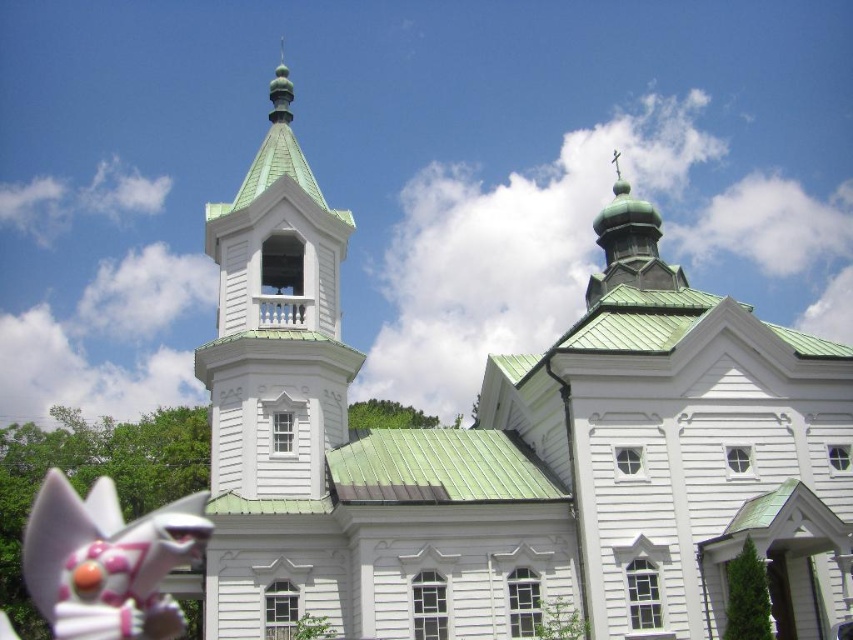
Question: Among these points, which one is farthest from the camera?

Choices:
 (A) (94, 628)
 (B) (308, 358)
 (C) (283, 536)

Answer: (A)

Question: Is green metallic church at upper left further to camera compared to green matte bell tower at upper center?

Choices:
 (A) no
 (B) yes

Answer: (A)

Question: Is green metallic church at upper left thinner than green matte bell tower at upper center?

Choices:
 (A) no
 (B) yes

Answer: (A)

Question: Estimate the real-world distances between objects in this image. Which object is closer to the white glossy cat figurine at lower left?

Choices:
 (A) green metallic church at upper left
 (B) green matte bell tower at upper center

Answer: (B)

Question: Which object is farther from the camera taking this photo?

Choices:
 (A) green matte bell tower at upper center
 (B) green metallic church at upper left
 (C) white glossy cat figurine at lower left

Answer: (A)

Question: Is green metallic church at upper left positioned in front of green matte bell tower at upper center?

Choices:
 (A) yes
 (B) no

Answer: (A)